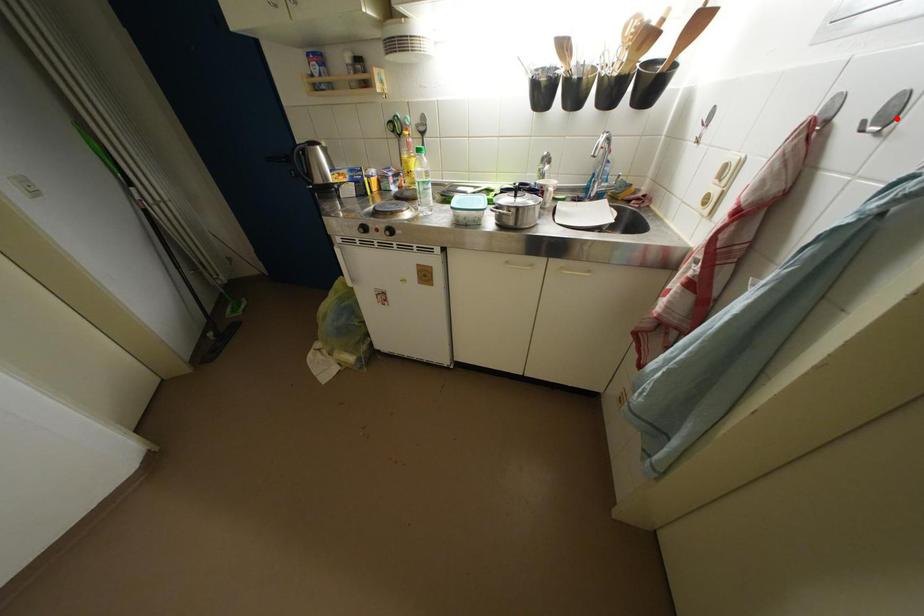
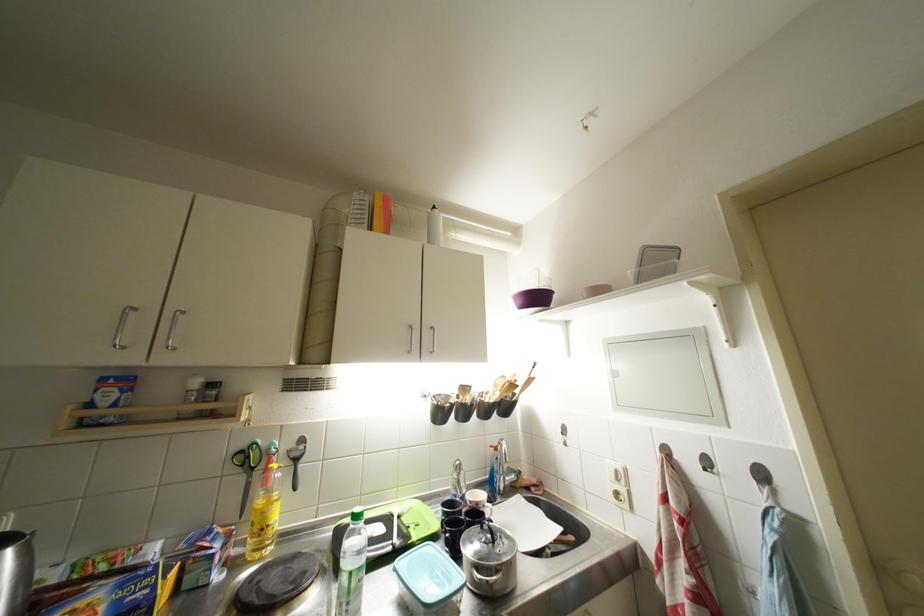
The point at the highlighted location is marked in the first image. Where is the corresponding point in the second image?

(714, 467)